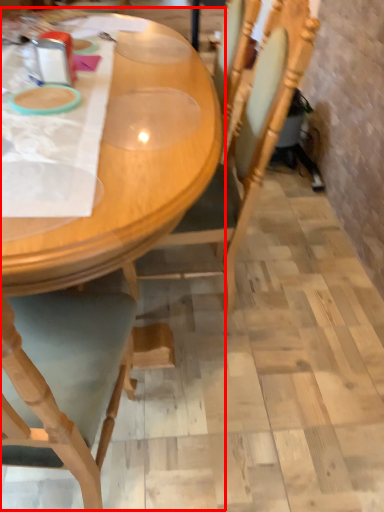
Question: Where is table (annotated by the red box) located in relation to chair in the image?

Choices:
 (A) right
 (B) left

Answer: (B)